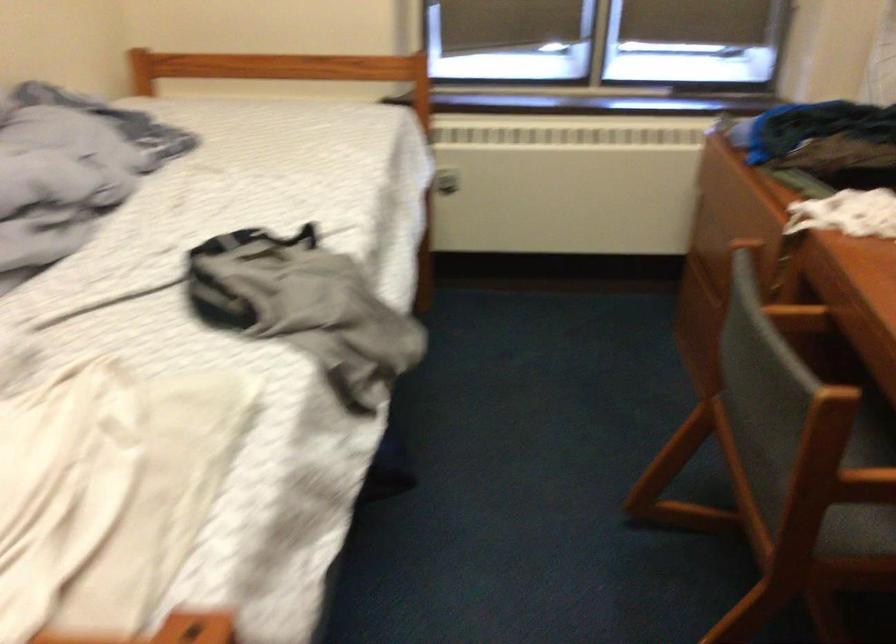
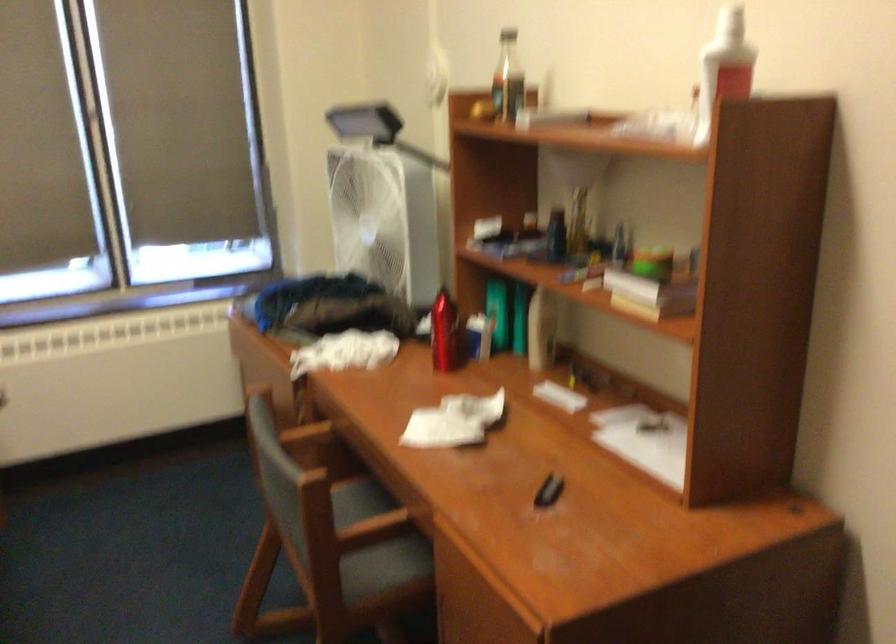
Find the pixel in the second image that matches point 796,315 in the first image.

(306, 435)